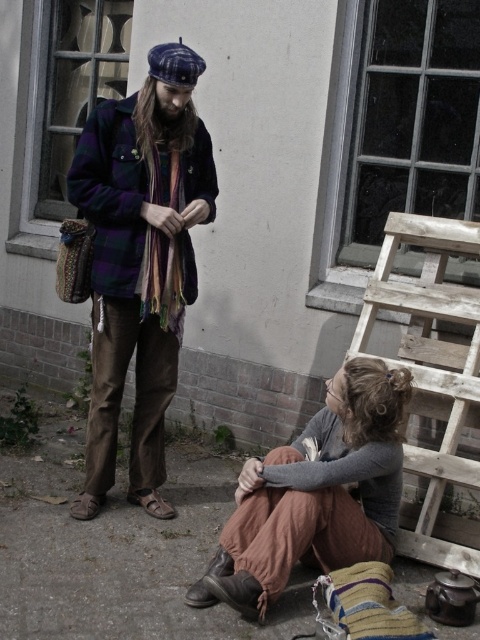
Can you confirm if plaid woolen jacket at center is taller than rustic brown pants at lower center?

Yes.

Based on the photo, is plaid woolen jacket at center thinner than rustic brown pants at lower center?

Yes.

Who is more forward, (139, 154) or (229, 592)?

Positioned in front is point (229, 592).

Identify the location of plaid woolen jacket at center. The image size is (480, 640). (141, 262).